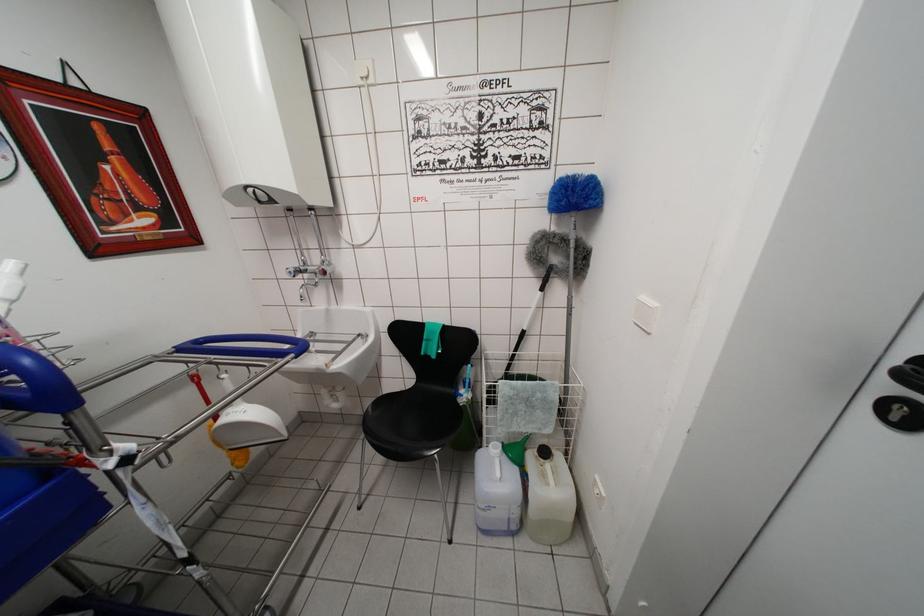
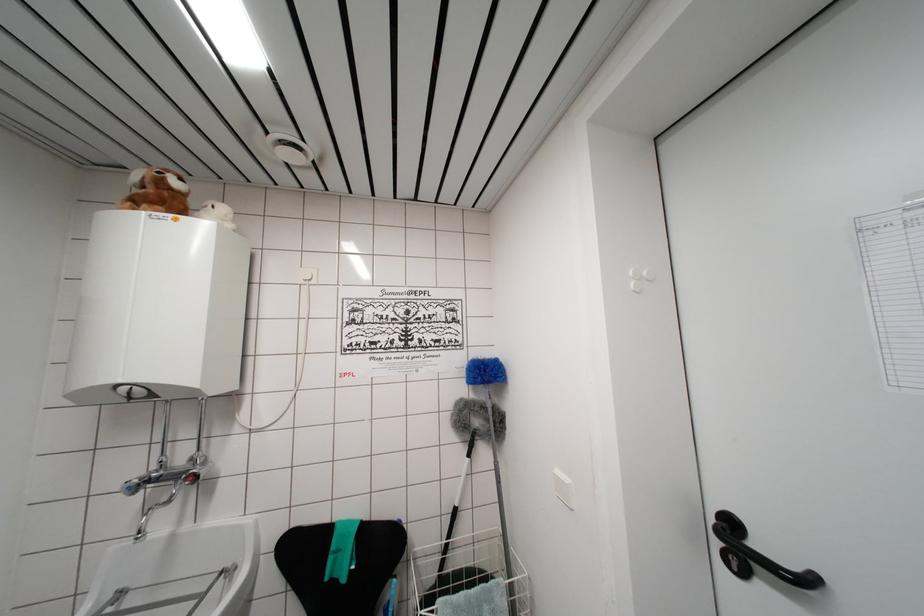
How did the camera likely rotate?

The camera's rotation is toward right-up.